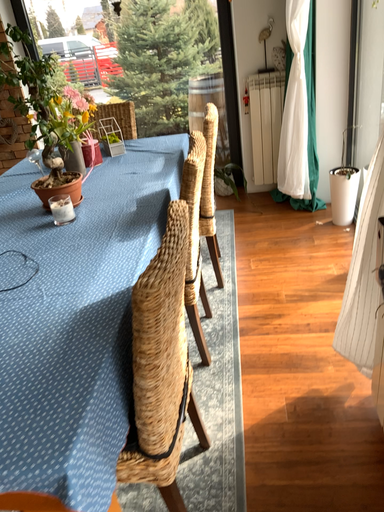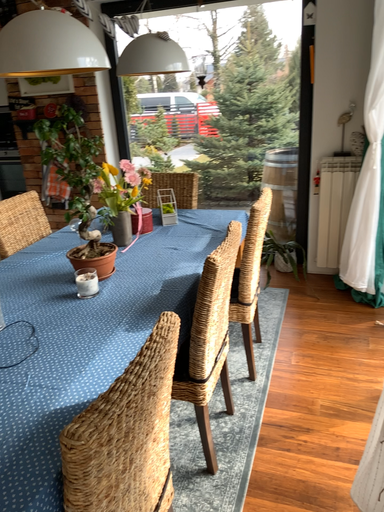
Question: Which way did the camera rotate in the video?

Choices:
 (A) rotated upward
 (B) rotated downward

Answer: (A)